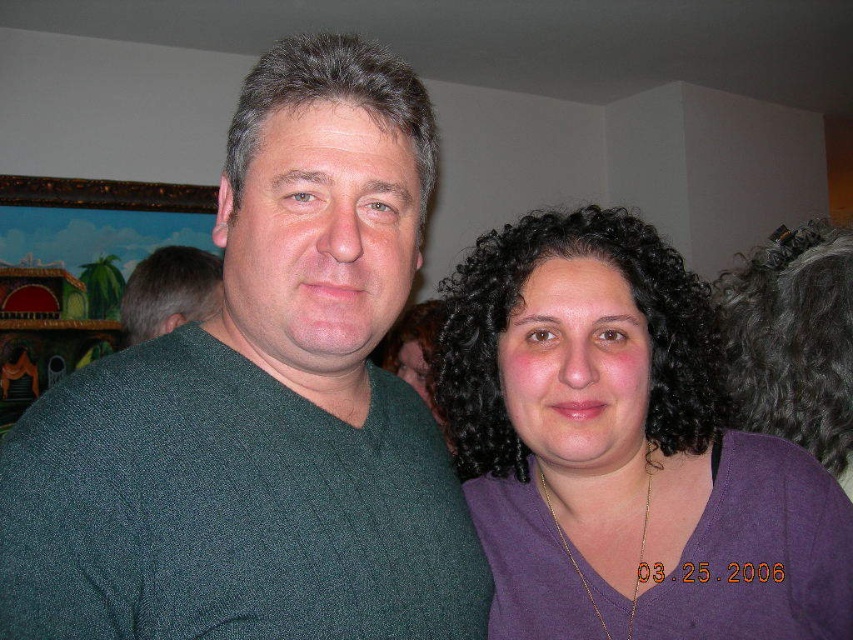
Describe the element at coordinates (260, 406) in the screenshot. The width and height of the screenshot is (853, 640). I see `dark green sweater at center` at that location.

Who is positioned more to the right, dark green sweater at center or purple matte shirt at center?

purple matte shirt at center

You are a GUI agent. You are given a task and a screenshot of the screen. Output one action in this format:
    pyautogui.click(x=<x>, y=<y>)
    Task: Click on the dark green sweater at center
    The image size is (853, 640).
    Given the screenshot: What is the action you would take?
    pyautogui.click(x=260, y=406)

Where is `dark green sweater at center`? dark green sweater at center is located at coordinates (260, 406).

Is dark green sweater at center positioned behind green knit sweater at center?

No, dark green sweater at center is in front of green knit sweater at center.

Is dark green sweater at center above green knit sweater at center?

No, dark green sweater at center is not above green knit sweater at center.

Where is `dark green sweater at center`? The image size is (853, 640). dark green sweater at center is located at coordinates (260, 406).

The height and width of the screenshot is (640, 853). Identify the location of dark green sweater at center. (260, 406).

Which is in front, point (585, 449) or point (212, 266)?

Positioned in front is point (585, 449).

Does purple matte shirt at center come in front of green knit sweater at center?

Yes, it is.

The height and width of the screenshot is (640, 853). What do you see at coordinates (624, 449) in the screenshot? I see `purple matte shirt at center` at bounding box center [624, 449].

Locate an element on the screen. This screenshot has width=853, height=640. purple matte shirt at center is located at coordinates point(624,449).